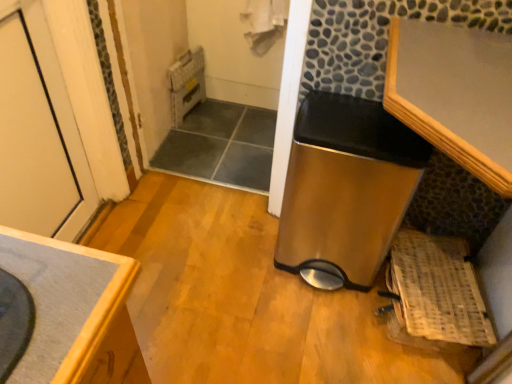
This screenshot has height=384, width=512. In order to click on woven wood basket at lower right in this screenshot , I will do `click(435, 294)`.

Find the location of a particular element. stainless steel trash can at center, which ranks as the 1th water heater in bottom-to-top order is located at coordinates (346, 187).

In order to click on wooden countertop at lower left in this screenshot , I will do `click(74, 311)`.

Looking at this image, from a real-world perspective, is woven wood basket at lower right under metallic gray water heater at upper center, the 2th water heater from the right?

Yes, from a real-world perspective, woven wood basket at lower right is under metallic gray water heater at upper center, the 2th water heater from the right.

Is metallic gray water heater at upper center, which is the 1th water heater from top to bottom, at the back of woven wood basket at lower right?

woven wood basket at lower right is not turned away from metallic gray water heater at upper center, which is the 1th water heater from top to bottom.

Is point (439, 320) positioned before point (201, 47)?

Yes, it is.

From a real-world perspective, count 1st water heaters upward from the woven wood basket at lower right and point to it. Please provide its 2D coordinates.

[(186, 83)]

Locate an element on the screen. The width and height of the screenshot is (512, 384). the 1st water heater directly above the woven wood basket at lower right (from a real-world perspective) is located at coordinates (186, 83).

From the picture: Is metallic gray water heater at upper center, which is the 1th water heater from top to bottom, thinner than woven wood basket at lower right?

Correct, the width of metallic gray water heater at upper center, which is the 1th water heater from top to bottom, is less than that of woven wood basket at lower right.

From a real-world perspective, is wooden countertop at lower left under stainless steel trash can at center, the 1th water heater in the front-to-back sequence?

No, from a real-world perspective, wooden countertop at lower left is not under stainless steel trash can at center, the 1th water heater in the front-to-back sequence.

From the image's perspective, is wooden countertop at lower left under stainless steel trash can at center, which ranks as the 1th water heater in bottom-to-top order?

Yes, from the image's perspective, wooden countertop at lower left is below stainless steel trash can at center, which ranks as the 1th water heater in bottom-to-top order.

Which of these two, wooden countertop at lower left or stainless steel trash can at center, arranged as the 2th water heater when viewed from the left, is wider?

Wider between the two is stainless steel trash can at center, arranged as the 2th water heater when viewed from the left.

Can you tell me how much wooden countertop at lower left and stainless steel trash can at center, the 1th water heater in the front-to-back sequence, differ in facing direction?

The angular difference between wooden countertop at lower left and stainless steel trash can at center, the 1th water heater in the front-to-back sequence, is 180 degrees.

Is metallic gray water heater at upper center, which is the 2th water heater from bottom to top, next to wooden countertop at lower left?

No, metallic gray water heater at upper center, which is the 2th water heater from bottom to top, is not touching wooden countertop at lower left.

What's the angular difference between metallic gray water heater at upper center, the first water heater viewed from the back, and wooden countertop at lower left's facing directions?

The facing directions of metallic gray water heater at upper center, the first water heater viewed from the back, and wooden countertop at lower left are 103 degrees apart.

Is metallic gray water heater at upper center, which is counted as the 2th water heater, starting from the front, facing away from wooden countertop at lower left?

metallic gray water heater at upper center, which is counted as the 2th water heater, starting from the front, does not have its back to wooden countertop at lower left.

Which of these two, stainless steel trash can at center, the 1th water heater positioned from the right, or woven wood basket at lower right, is wider?

Wider between the two is woven wood basket at lower right.

In the scene shown: Is stainless steel trash can at center, which ranks as the 1th water heater in bottom-to-top order, beside woven wood basket at lower right?

No, stainless steel trash can at center, which ranks as the 1th water heater in bottom-to-top order, is not in contact with woven wood basket at lower right.

Is stainless steel trash can at center, arranged as the 2th water heater when viewed from the left, positioned behind woven wood basket at lower right?

No, it is in front of woven wood basket at lower right.

From the image's perspective, which one is positioned lower, stainless steel trash can at center, the 1th water heater positioned from the right, or woven wood basket at lower right?

woven wood basket at lower right, from the image's perspective.

Looking at this image, from the image's perspective, is metallic gray water heater at upper center, the 2th water heater from the right, located above or below white painted wood door at left?

metallic gray water heater at upper center, the 2th water heater from the right, is above white painted wood door at left.

Is metallic gray water heater at upper center, the first water heater in the left-to-right sequence, smaller than white painted wood door at left?

Yes, metallic gray water heater at upper center, the first water heater in the left-to-right sequence, is smaller than white painted wood door at left.

Measure the distance between metallic gray water heater at upper center, the 2th water heater from the right, and white painted wood door at left.

34.22 inches.

Who is shorter, metallic gray water heater at upper center, which is the 2th water heater from bottom to top, or white painted wood door at left?

With less height is metallic gray water heater at upper center, which is the 2th water heater from bottom to top.

From a real-world perspective, is woven wood basket at lower right located beneath wooden countertop at lower left?

Yes, from a real-world perspective, woven wood basket at lower right is below wooden countertop at lower left.

Considering the sizes of objects woven wood basket at lower right and wooden countertop at lower left in the image provided, who is shorter, woven wood basket at lower right or wooden countertop at lower left?

woven wood basket at lower right is shorter.

The image size is (512, 384). I want to click on water heater behind the woven wood basket at lower right, so click(186, 83).

At what (x,y) coordinates should I click in order to perform the action: click on basket in front of the metallic gray water heater at upper center, which is the 1th water heater from top to bottom. Please return your answer as a coordinate pair (x, y). The image size is (512, 384). Looking at the image, I should click on (435, 294).

Considering their positions, is stainless steel trash can at center, arranged as the 2th water heater when viewed from the left, positioned closer to wooden countertop at lower left than woven wood basket at lower right?

stainless steel trash can at center, arranged as the 2th water heater when viewed from the left, is positioned closer to the anchor wooden countertop at lower left.

From the image, which object appears to be farther from white painted wood door at left, woven wood basket at lower right or metallic gray water heater at upper center, which is counted as the 2th water heater, starting from the front?

Among the two, woven wood basket at lower right is located further to white painted wood door at left.

Considering their positions, is woven wood basket at lower right positioned further to metallic gray water heater at upper center, which is the 1th water heater from top to bottom, than white painted wood door at left?

woven wood basket at lower right is further to metallic gray water heater at upper center, which is the 1th water heater from top to bottom.

Estimate the real-world distances between objects in this image. Which object is closer to woven wood basket at lower right, stainless steel trash can at center, which ranks as the 1th water heater in bottom-to-top order, or white painted wood door at left?

Among the two, stainless steel trash can at center, which ranks as the 1th water heater in bottom-to-top order, is located nearer to woven wood basket at lower right.

Considering their positions, is woven wood basket at lower right positioned further to white painted wood door at left than stainless steel trash can at center, positioned as the 2th water heater in back-to-front order?

Based on the image, woven wood basket at lower right appears to be further to white painted wood door at left.

Estimate the real-world distances between objects in this image. Which object is closer to wooden countertop at lower left, white painted wood door at left or stainless steel trash can at center, arranged as the 2th water heater when viewed from the top?

stainless steel trash can at center, arranged as the 2th water heater when viewed from the top.

Estimate the real-world distances between objects in this image. Which object is closer to woven wood basket at lower right, wooden countertop at lower left or metallic gray water heater at upper center, the first water heater in the left-to-right sequence?

wooden countertop at lower left is closer to woven wood basket at lower right.

When comparing their distances from white painted wood door at left, does stainless steel trash can at center, which ranks as the 1th water heater in bottom-to-top order, or wooden countertop at lower left seem closer?

wooden countertop at lower left.

Find the location of a particular element. water heater between white painted wood door at left and metallic gray water heater at upper center, the first water heater in the left-to-right sequence, in the front-back direction is located at coordinates (346, 187).

You are a GUI agent. You are given a task and a screenshot of the screen. Output one action in this format:
    pyautogui.click(x=<x>, y=<y>)
    Task: Click on the water heater located between wooden countertop at lower left and metallic gray water heater at upper center, the first water heater in the left-to-right sequence, in the depth direction
    The image size is (512, 384).
    Given the screenshot: What is the action you would take?
    pyautogui.click(x=346, y=187)

I want to click on cabinetry between white painted wood door at left and stainless steel trash can at center, which ranks as the 1th water heater in bottom-to-top order, from left to right, so click(x=74, y=311).

Where is `basket between stainless steel trash can at center, arranged as the 2th water heater when viewed from the top, and metallic gray water heater at upper center, the 2th water heater from the right, in the front-back direction`? The width and height of the screenshot is (512, 384). basket between stainless steel trash can at center, arranged as the 2th water heater when viewed from the top, and metallic gray water heater at upper center, the 2th water heater from the right, in the front-back direction is located at coordinates (435, 294).